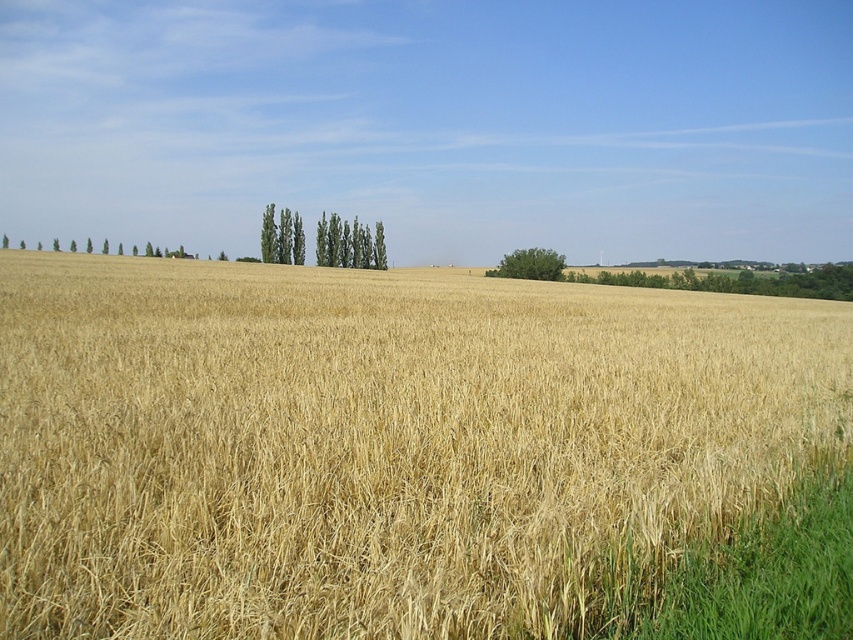
You are standing in the wheat field and want to take a photo of both the golden dry grass at center and the green leafy trees at center. Which object will appear larger in the photo?

The golden dry grass at center will appear larger in the photo because it is closer to the viewer than the green leafy trees at center.

You are a farmer planning to plant a new row of trees between the green leafy trees at center and the green leafy tree at center. Which tree should you use as a reference for spacing to ensure proper growth?

You should use the green leafy trees at center as a reference for spacing because it is larger in size than the green leafy tree at center, ensuring adequate space for growth.